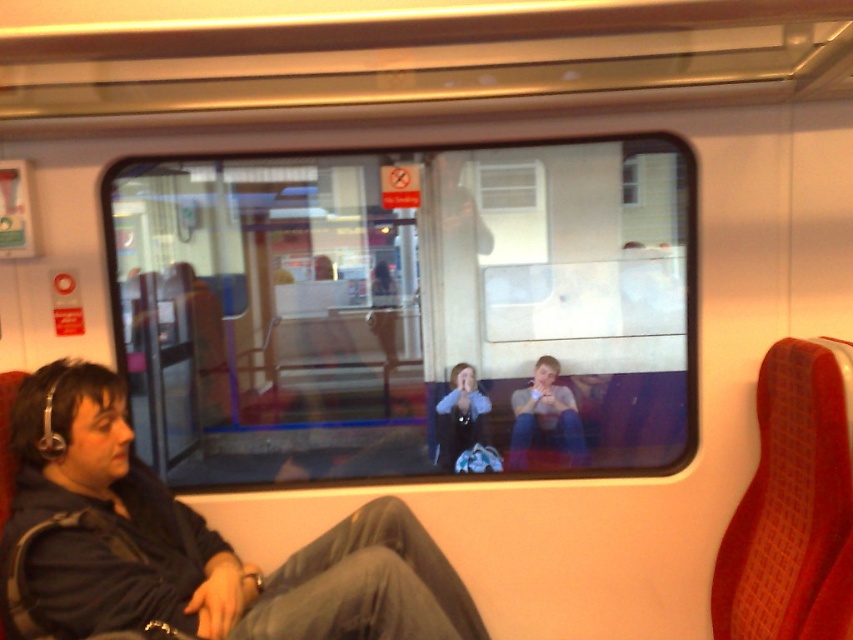
Is point (186, 612) closer to camera compared to point (477, 429)?

Yes, point (186, 612) is in front of point (477, 429).

Who is more forward, (68, 589) or (440, 451)?

Positioned in front is point (68, 589).

Describe the element at coordinates (189, 545) in the screenshot. I see `dark gray fabric coach at lower left` at that location.

In order to click on dark gray fabric coach at lower left in this screenshot , I will do `click(189, 545)`.

Is point (607, 300) behind point (485, 401)?

That is False.

Does clear glass window at center have a greater width compared to blue denim jacket at center?

Yes, clear glass window at center is wider than blue denim jacket at center.

Is point (691, 432) positioned behind point (444, 461)?

That is False.

Locate an element on the screen. This screenshot has height=640, width=853. clear glass window at center is located at coordinates (405, 308).

Between point (381, 392) and point (334, 561), which one is positioned behind?

The point (381, 392) is behind.

Is point (462, 189) less distant than point (368, 516)?

No, it is not.

The image size is (853, 640). I want to click on clear glass window at center, so click(405, 308).